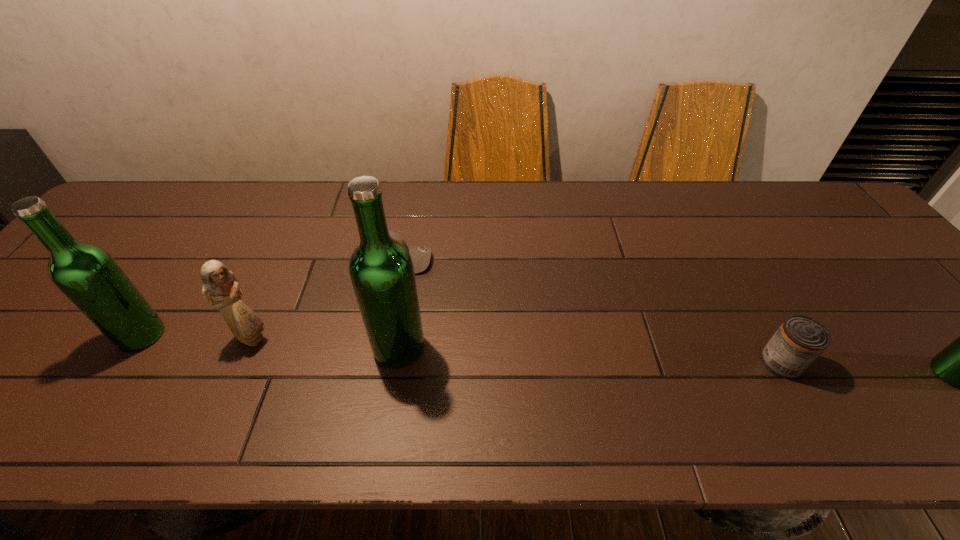
If we want them evenly spaced by inserting an extra beer_bottle among them, please locate a free spot for this new beer_bottle. Please provide its 2D coordinates. Your answer should be formatted as a tuple, i.e. [(x, y)], where the tuple contains the x and y coordinates of a point satisfying the conditions above.

[(669, 360)]